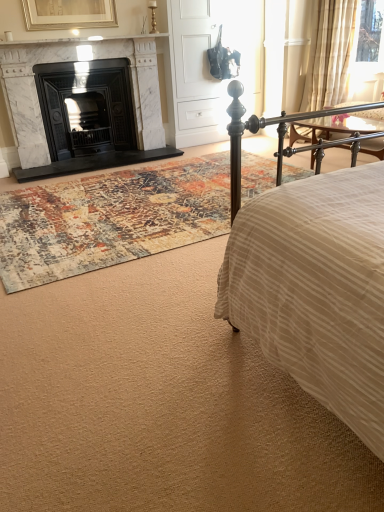
Question: Is white marble fireplace at left, which ranks as the 1th fireplace in right-to-left order, a part of gold metallic table lamp at upper center?

Choices:
 (A) yes
 (B) no

Answer: (B)

Question: Can you confirm if gold metallic table lamp at upper center is smaller than white marble fireplace at left, positioned as the second fireplace in left-to-right order?

Choices:
 (A) no
 (B) yes

Answer: (B)

Question: Could you tell me if gold metallic table lamp at upper center is turned towards white marble fireplace at left, positioned as the second fireplace in left-to-right order?

Choices:
 (A) no
 (B) yes

Answer: (A)

Question: Is gold metallic table lamp at upper center outside of white marble fireplace at left, positioned as the second fireplace in left-to-right order?

Choices:
 (A) yes
 (B) no

Answer: (A)

Question: Considering the relative sizes of gold metallic table lamp at upper center and white marble fireplace at left, which ranks as the 1th fireplace in right-to-left order, in the image provided, is gold metallic table lamp at upper center shorter than white marble fireplace at left, which ranks as the 1th fireplace in right-to-left order,?

Choices:
 (A) yes
 (B) no

Answer: (A)

Question: Does gold metallic table lamp at upper center appear on the right side of white marble fireplace at left, positioned as the second fireplace in left-to-right order?

Choices:
 (A) no
 (B) yes

Answer: (B)

Question: Can sheer beige fabric at upper right be found inside white matte armoire at center?

Choices:
 (A) no
 (B) yes

Answer: (A)

Question: Considering the relative sizes of white matte armoire at center and sheer beige fabric at upper right in the image provided, is white matte armoire at center thinner than sheer beige fabric at upper right?

Choices:
 (A) yes
 (B) no

Answer: (A)

Question: Is white matte armoire at center outside sheer beige fabric at upper right?

Choices:
 (A) yes
 (B) no

Answer: (A)

Question: From the image's perspective, is white matte armoire at center above sheer beige fabric at upper right?

Choices:
 (A) no
 (B) yes

Answer: (B)

Question: Would you say white matte armoire at center is a long distance from sheer beige fabric at upper right?

Choices:
 (A) yes
 (B) no

Answer: (A)

Question: Is white matte armoire at center to the left of sheer beige fabric at upper right from the viewer's perspective?

Choices:
 (A) yes
 (B) no

Answer: (A)

Question: Is white marble fireplace at left, positioned as the second fireplace in left-to-right order, positioned beyond the bounds of white matte armoire at center?

Choices:
 (A) no
 (B) yes

Answer: (B)